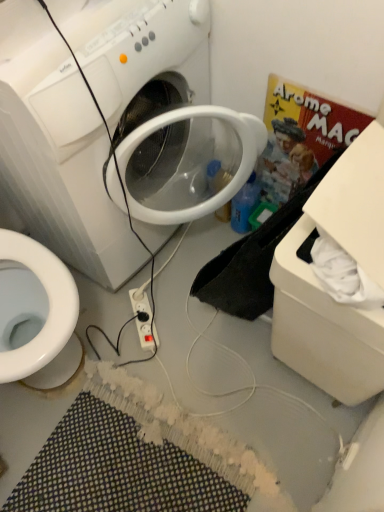
Question: Is white plastic washing machine at center positioned with its back to blue plastic bottle at center-right?

Choices:
 (A) no
 (B) yes

Answer: (A)

Question: Does white plastic washing machine at center appear on the right side of blue plastic bottle at center-right?

Choices:
 (A) yes
 (B) no

Answer: (B)

Question: Considering the relative sizes of white plastic washing machine at center and blue plastic bottle at center-right in the image provided, is white plastic washing machine at center taller than blue plastic bottle at center-right?

Choices:
 (A) no
 (B) yes

Answer: (B)

Question: Are white plastic washing machine at center and blue plastic bottle at center-right far apart?

Choices:
 (A) yes
 (B) no

Answer: (B)

Question: Considering the relative sizes of white plastic washing machine at center and blue plastic bottle at center-right in the image provided, is white plastic washing machine at center thinner than blue plastic bottle at center-right?

Choices:
 (A) no
 (B) yes

Answer: (A)

Question: Is white plastic washing machine at center facing towards blue plastic bottle at center-right?

Choices:
 (A) no
 (B) yes

Answer: (B)

Question: Is white plastic box at lower right positioned far away from multicolored woven bath mat at lower center?

Choices:
 (A) no
 (B) yes

Answer: (A)

Question: Is white plastic box at lower right located outside multicolored woven bath mat at lower center?

Choices:
 (A) yes
 (B) no

Answer: (A)

Question: Does white plastic box at lower right have a lesser width compared to multicolored woven bath mat at lower center?

Choices:
 (A) yes
 (B) no

Answer: (A)

Question: Considering the relative sizes of white plastic box at lower right and multicolored woven bath mat at lower center in the image provided, is white plastic box at lower right wider than multicolored woven bath mat at lower center?

Choices:
 (A) yes
 (B) no

Answer: (B)

Question: Is white plastic box at lower right aimed at multicolored woven bath mat at lower center?

Choices:
 (A) no
 (B) yes

Answer: (A)

Question: Is the position of white plastic box at lower right less distant than that of multicolored woven bath mat at lower center?

Choices:
 (A) no
 (B) yes

Answer: (B)

Question: Is white plastic power outlet at center next to blue plastic bottle at center-right?

Choices:
 (A) yes
 (B) no

Answer: (B)